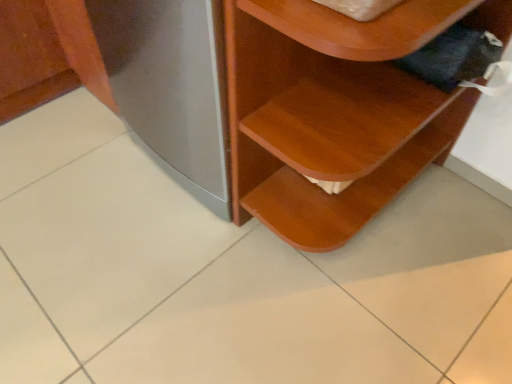
Find the location of a particular element. The width and height of the screenshot is (512, 384). vacant region in front of wooden shelf at center is located at coordinates (359, 314).